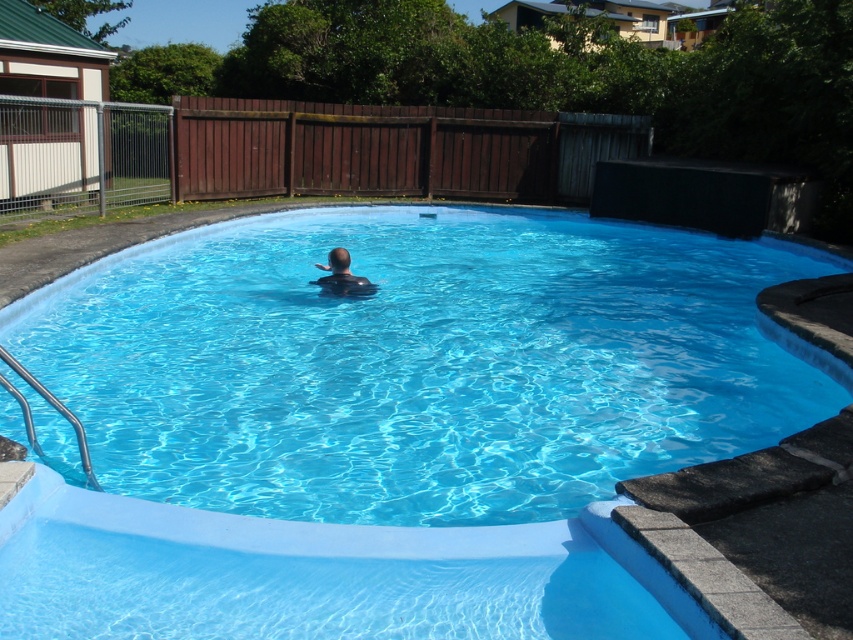
Does point (308, 220) come behind point (357, 280)?

That is True.

Who is shorter, blue smooth pool at center or dark blue skin at center?

Standing shorter between the two is dark blue skin at center.

Describe the element at coordinates (386, 424) in the screenshot. I see `blue smooth pool at center` at that location.

Identify the location of blue smooth pool at center. The width and height of the screenshot is (853, 640). (386, 424).